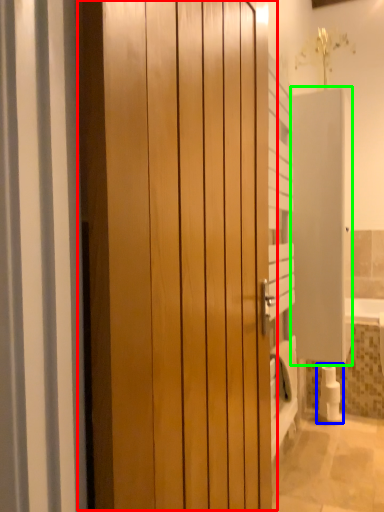
Question: Which object is positioned closest to door (highlighted by a red box)? Select from toilet paper (highlighted by a blue box) and screen door (highlighted by a green box).

Choices:
 (A) toilet paper
 (B) screen door

Answer: (B)